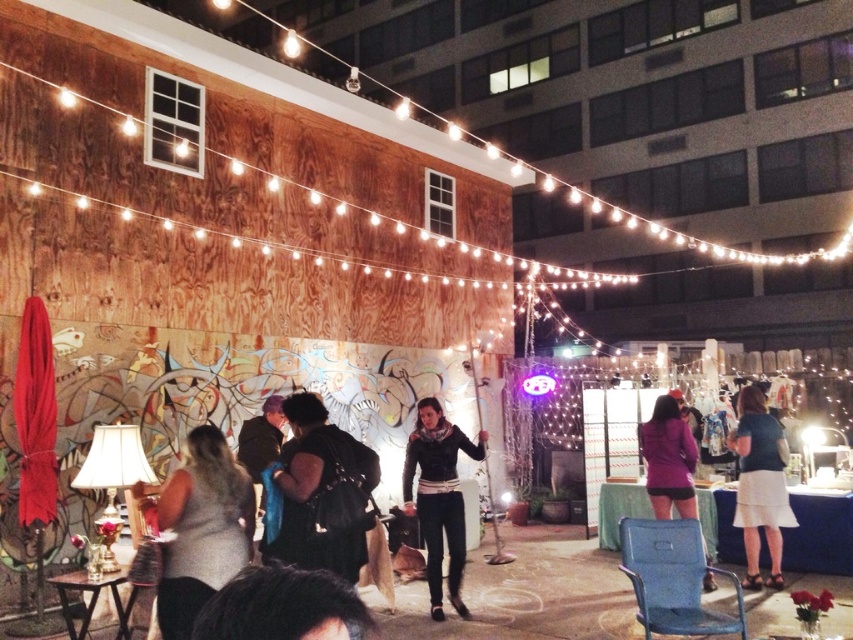
You are at an outdoor evening gathering and want to find the purple matte jacket at center. Which direction should you look relative to the matte black dress at lower left?

The purple matte jacket at center is to the right of the matte black dress at lower left.

You are at the outdoor evening gathering and want to find the black matte jacket at center. According to the coordinates provided, where exactly is it positioned?

The black matte jacket at center is located at point 0.770 on the x axis and 0.379 on the y axis.